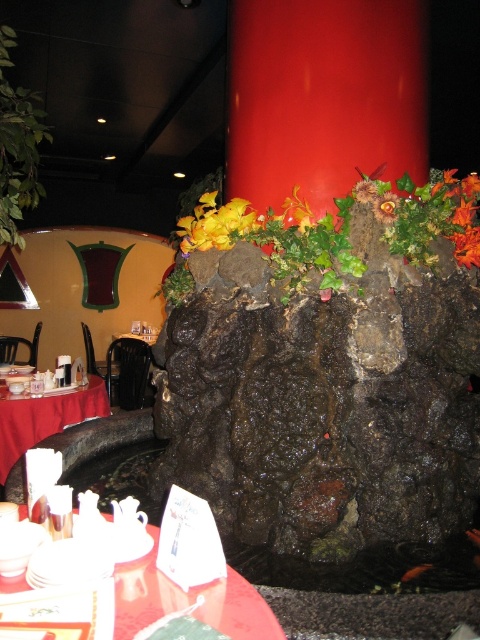
You are a server in this dining area and need to place a tall vase on the table. The vase is taller than the leaves and flowers at center. Will it fit on the red satin tablecloth at lower left without exceeding the table height?

The leaves and flowers at center are taller than the red satin tablecloth at lower left. Since the vase is taller than the leaves and flowers at center, it will exceed the table height and not fit properly on the red satin tablecloth at lower left.

You are a guest at this restaurant and want to place your napkin on the closest object to you between the leaves and flowers at center and the yellow fabric flower at center. Which object should you choose?

The leaves and flowers at center is closer to the viewer than the yellow fabric flower at center, so you should place your napkin on the leaves and flowers at center.

You are a guest at this restaurant and want to place your napkin on the table. The leaves and flowers at center and the yellow fabric flower at center are both on the table. Which one is positioned to the right of the other?

The leaves and flowers at center is positioned to the right of the yellow fabric flower at center.